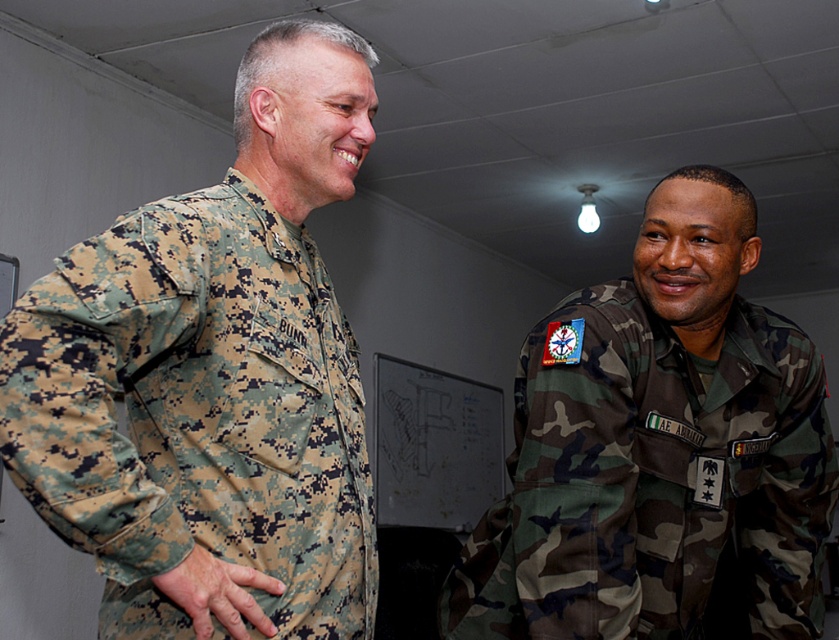
Question: Which of the following is the closest to the observer?

Choices:
 (A) (316, 545)
 (B) (460, 637)

Answer: (A)

Question: Is digital camouflage uniform at left bigger than camo uniform at right?

Choices:
 (A) no
 (B) yes

Answer: (A)

Question: Is digital camouflage uniform at left smaller than camo uniform at right?

Choices:
 (A) no
 (B) yes

Answer: (B)

Question: Which object is closer to the camera taking this photo?

Choices:
 (A) camo uniform at right
 (B) digital camouflage uniform at left

Answer: (B)

Question: Is digital camouflage uniform at left above camo uniform at right?

Choices:
 (A) yes
 (B) no

Answer: (A)